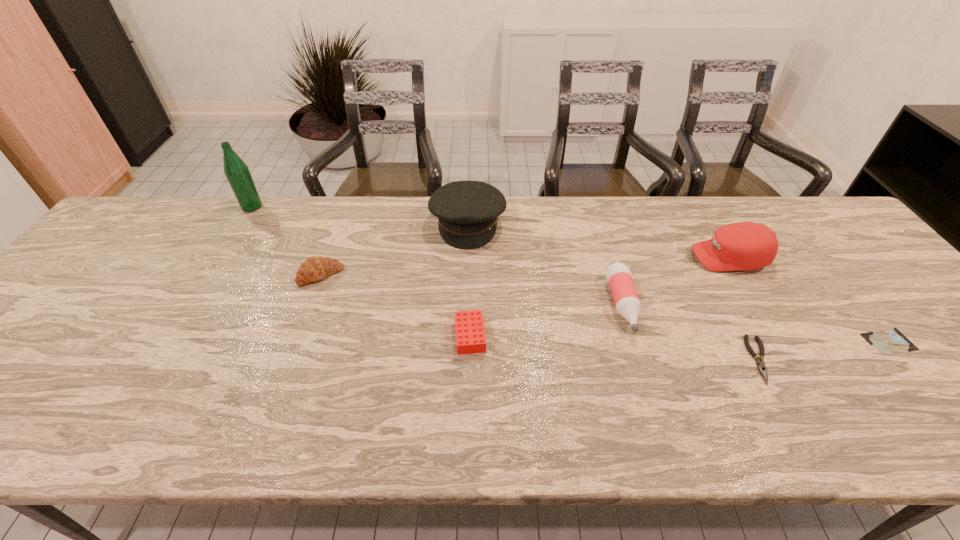
The height and width of the screenshot is (540, 960). In order to click on vacant space that satisfies the following two spatial constraints: 1. on the front-facing side of the cap; 2. on the left side of the rightmost object in this screenshot , I will do `click(778, 341)`.

Find the location of `vacant region that satisfies the following two spatial constraints: 1. on the front side of the fourth shortest object; 2. on the right side of the seventh tallest object`. vacant region that satisfies the following two spatial constraints: 1. on the front side of the fourth shortest object; 2. on the right side of the seventh tallest object is located at coordinates click(291, 360).

Find the location of a particular element. vacant space that satisfies the following two spatial constraints: 1. on the front-facing side of the beret; 2. on the left side of the identity card is located at coordinates (464, 341).